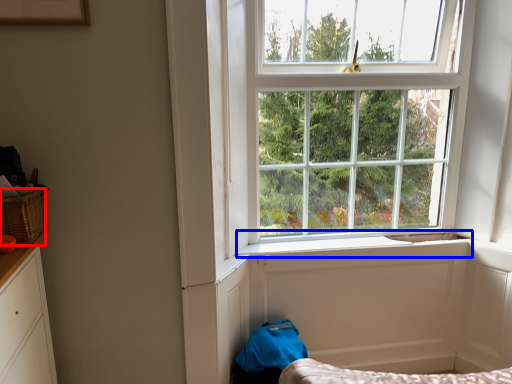
Question: Which object is further to the camera taking this photo, basket (highlighted by a red box) or window sill (highlighted by a blue box)?

Choices:
 (A) basket
 (B) window sill

Answer: (B)